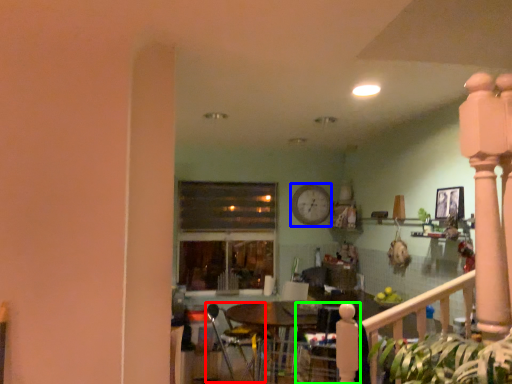
Question: Which object is the closest to the armchair (highlighted by a red box)? Choose among these: clock (highlighted by a blue box) or armchair (highlighted by a green box).

Choices:
 (A) clock
 (B) armchair

Answer: (B)